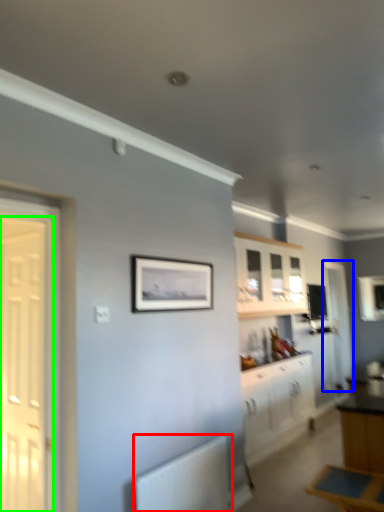
Question: Which is nearer to the radiator (highlighted by a red box)? door (highlighted by a blue box) or door (highlighted by a green box).

Choices:
 (A) door
 (B) door

Answer: (B)